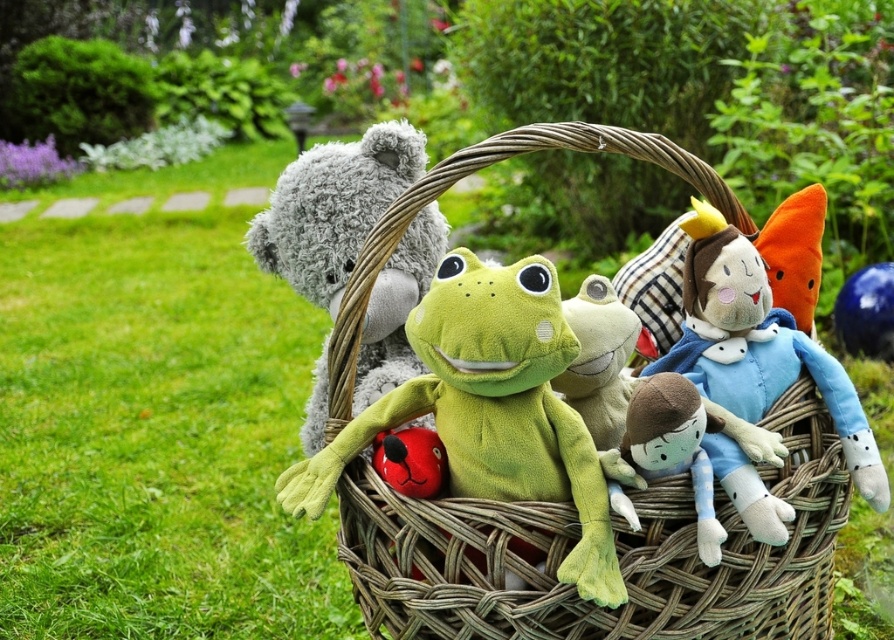
Question: Which of the following is the closest to the observer?

Choices:
 (A) (840, 406)
 (B) (462, 163)

Answer: (B)

Question: Where is green plush frog at center located in relation to blue plush doll at center in the image?

Choices:
 (A) below
 (B) above

Answer: (A)

Question: Can you confirm if green plush frog at center is wider than blue plush doll at center?

Choices:
 (A) no
 (B) yes

Answer: (B)

Question: Which point appears farthest from the camera in this image?

Choices:
 (A) (572, 433)
 (B) (684, 284)

Answer: (B)

Question: Is woven wicker basket at center behind blue plush doll at center?

Choices:
 (A) no
 (B) yes

Answer: (A)

Question: Which point is farther from the camera taking this photo?

Choices:
 (A) (718, 260)
 (B) (808, 387)
 (C) (437, 426)

Answer: (B)